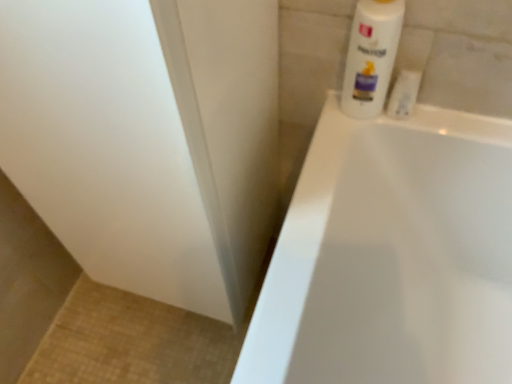
Question: Does point (396, 84) appear closer or farther from the camera than point (381, 99)?

Choices:
 (A) farther
 (B) closer

Answer: (B)

Question: In the image, is white plastic tube at upper right positioned in front of or behind white glossy lotion at upper right?

Choices:
 (A) behind
 (B) front

Answer: (A)

Question: From a real-world perspective, relative to white glossy lotion at upper right, is white plastic tube at upper right vertically above or below?

Choices:
 (A) below
 (B) above

Answer: (A)

Question: Would you say white glossy lotion at upper right is to the left or to the right of white plastic tube at upper right in the picture?

Choices:
 (A) left
 (B) right

Answer: (A)

Question: From the image's perspective, relative to white plastic tube at upper right, is white glossy lotion at upper right above or below?

Choices:
 (A) below
 (B) above

Answer: (B)

Question: Which is correct: white glossy lotion at upper right is inside white plastic tube at upper right, or outside of it?

Choices:
 (A) outside
 (B) inside

Answer: (A)

Question: Is white glossy lotion at upper right bigger or smaller than white plastic tube at upper right?

Choices:
 (A) small
 (B) big

Answer: (B)